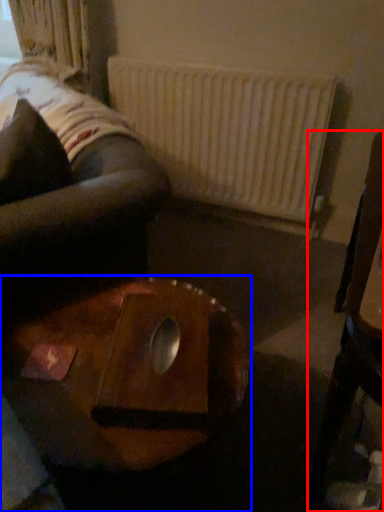
Question: Which object is further to the camera taking this photo, furniture (highlighted by a red box) or table (highlighted by a blue box)?

Choices:
 (A) furniture
 (B) table

Answer: (B)